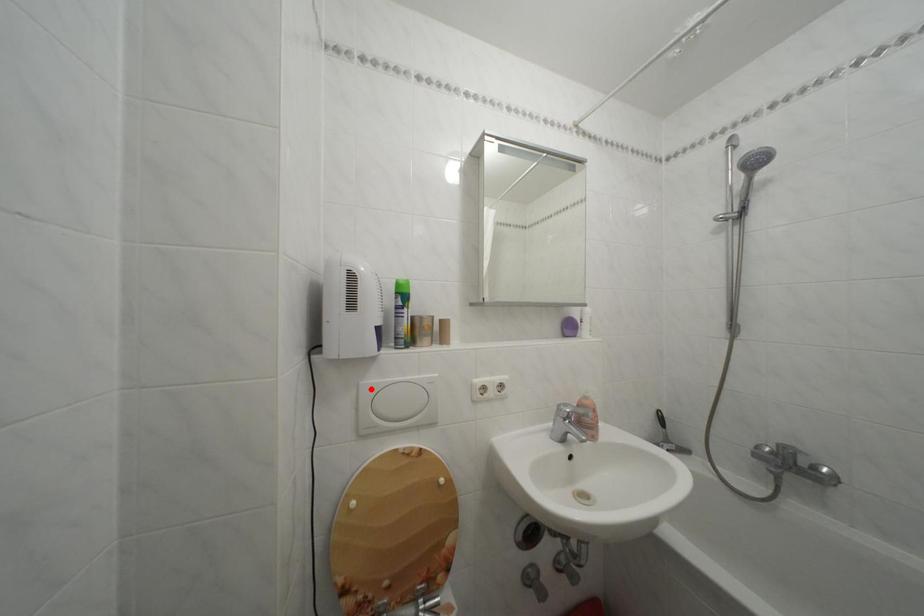
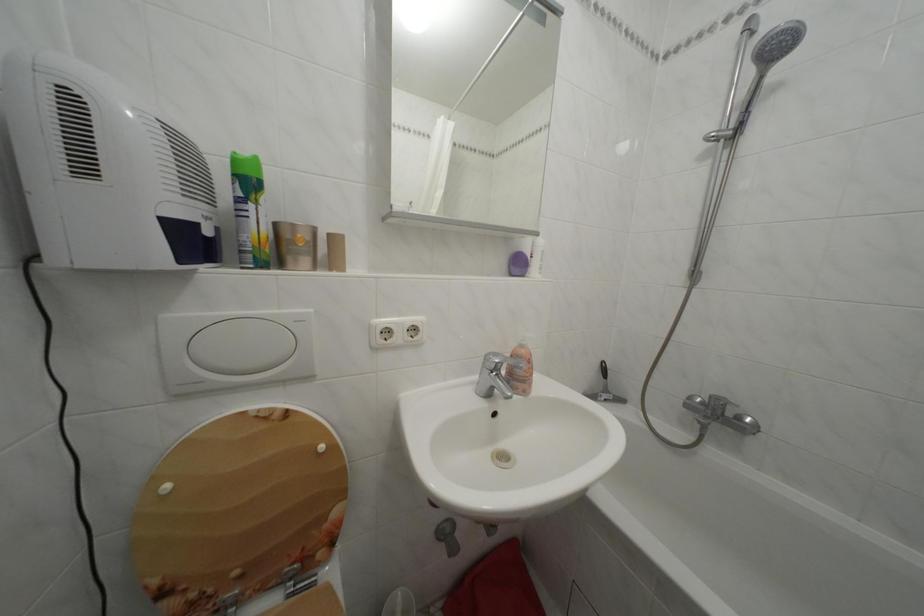
Locate, in the second image, the point that corresponds to the highlighted location in the first image.

(174, 323)